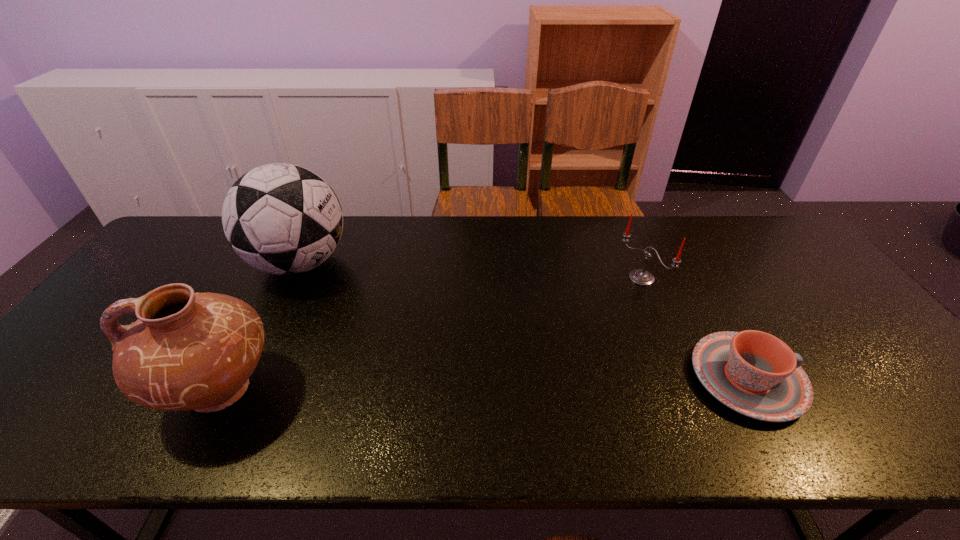
Find the location of a particular element. Image resolution: width=960 pixels, height=540 pixels. vacant space on the desktop that is between the pottery and the chinaware and is positioned on the surface of the soccer ball where the brand logo is visible is located at coordinates (450, 385).

Identify the location of free spot on the desktop that is between the pottery and the chinaware and is positioned on the front-facing side of the candle. Image resolution: width=960 pixels, height=540 pixels. (511, 384).